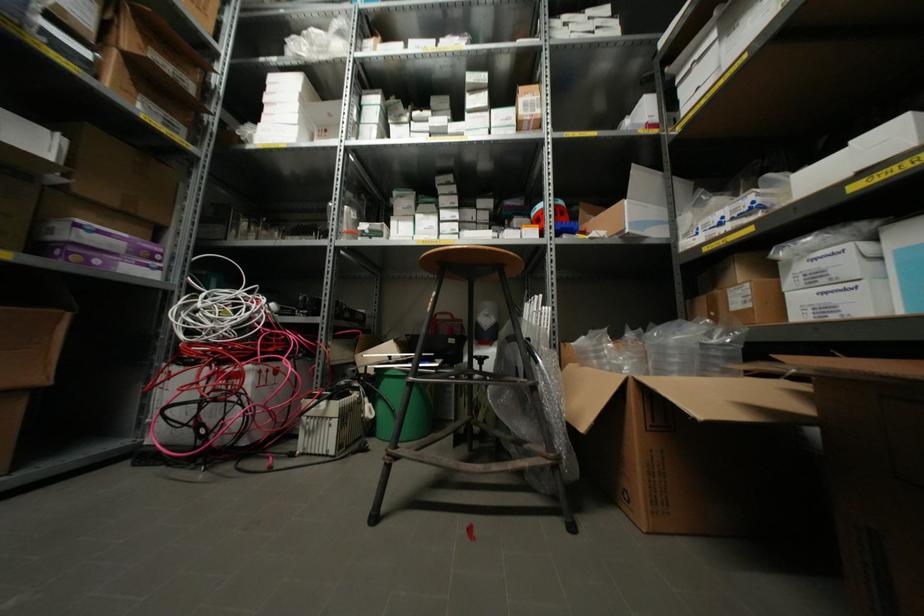
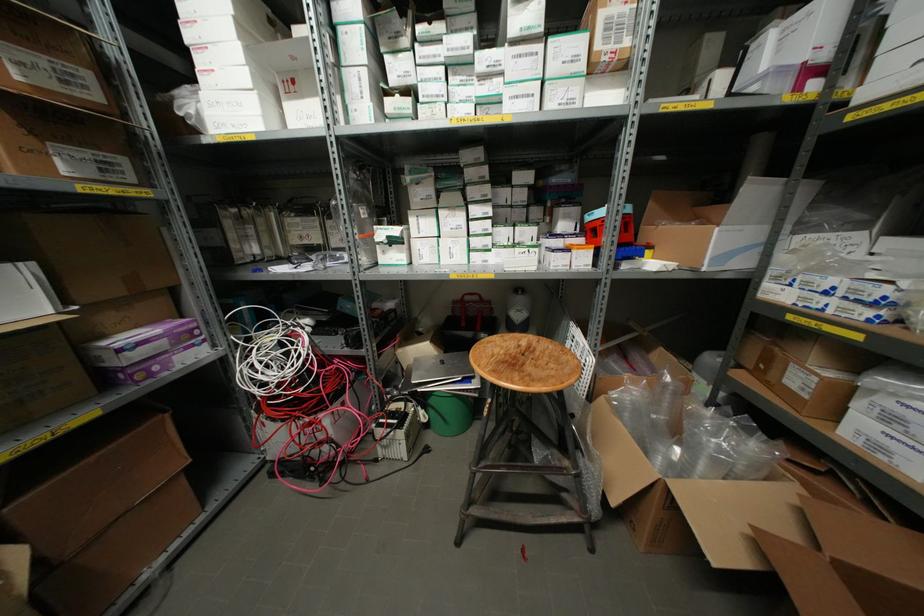
In the second image, find the point that corresponds to point 297,103 in the first image.

(237, 44)